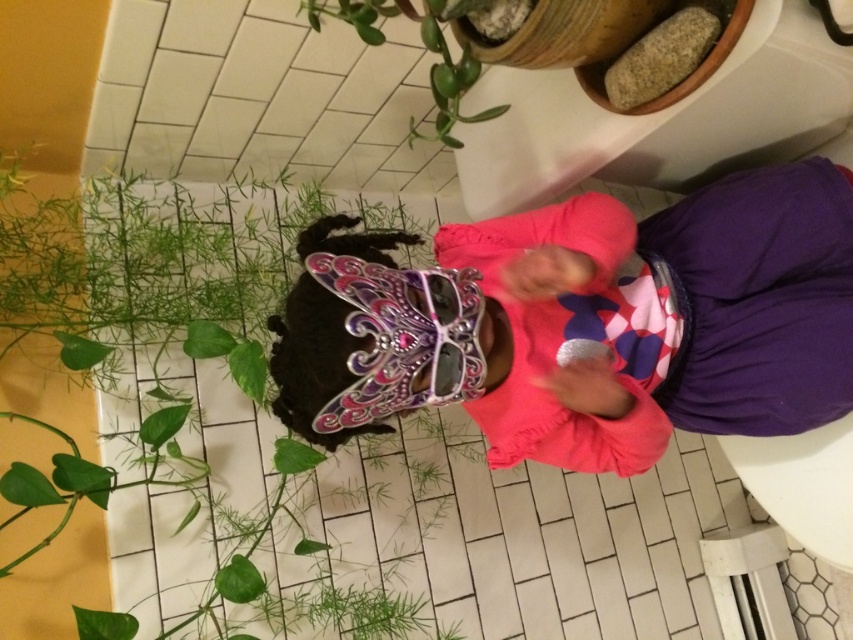
Question: Which object appears closest to the camera in this image?

Choices:
 (A) green leafy plant at center
 (B) green glossy plant at upper center

Answer: (B)

Question: Is pink metallic mask at center smaller than green leafy plant at center?

Choices:
 (A) yes
 (B) no

Answer: (A)

Question: Which of these objects is positioned closest to the green leafy plant at center?

Choices:
 (A) pink metallic mask at center
 (B) green glossy plant at upper center

Answer: (A)

Question: Among these points, which one is nearest to the camera?

Choices:
 (A) (306, 600)
 (B) (447, 67)
 (C) (720, 250)

Answer: (B)

Question: From the image, what is the correct spatial relationship of pink metallic mask at center in relation to green leafy plant at center?

Choices:
 (A) above
 (B) below

Answer: (A)

Question: Does pink metallic mask at center appear over green leafy plant at center?

Choices:
 (A) yes
 (B) no

Answer: (A)